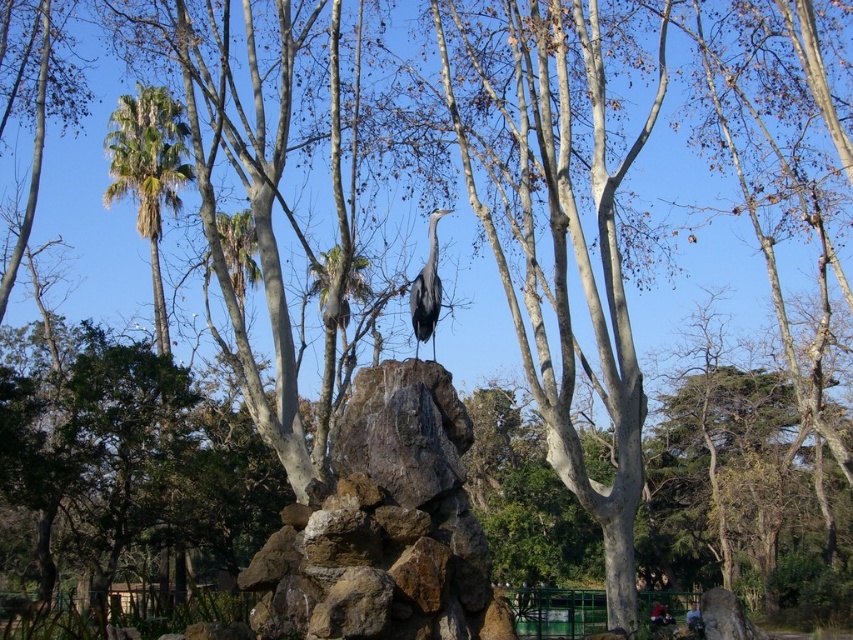
Who is taller, brown rough rock at center or green leafy palm at left?

With more height is green leafy palm at left.

Is point (486, 636) positioned after point (134, 99)?

No.

Locate an element on the screen. This screenshot has width=853, height=640. brown rough rock at center is located at coordinates (386, 525).

Is brown rough rock at center to the right of gray matte heron at center from the viewer's perspective?

No, brown rough rock at center is not to the right of gray matte heron at center.

Which is below, brown rough rock at center or gray matte heron at center?

brown rough rock at center is below.

Locate an element on the screen. brown rough rock at center is located at coordinates (386, 525).

The height and width of the screenshot is (640, 853). I want to click on brown rough rock at center, so click(x=386, y=525).

Is point (129, 125) closer to camera compared to point (428, 326)?

No, (129, 125) is further to viewer.

Who is taller, green leafy palm at left or gray matte heron at center?

green leafy palm at left

Is point (160, 340) farther from camera compared to point (415, 298)?

Yes, it is behind point (415, 298).

Where is `green leafy palm at left`? The image size is (853, 640). green leafy palm at left is located at coordinates (148, 173).